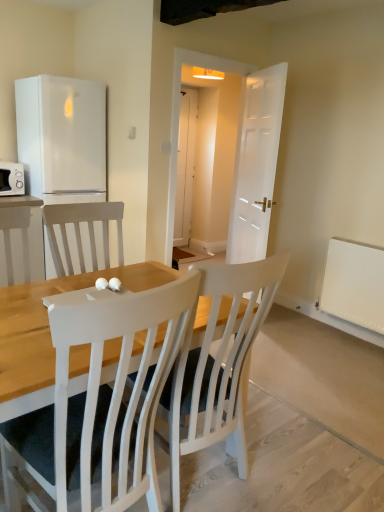
Question: Can you confirm if white matte microwave at left is positioned to the right of white wood chair at center?

Choices:
 (A) yes
 (B) no

Answer: (B)

Question: Can you confirm if white matte microwave at left is taller than white wood chair at center?

Choices:
 (A) yes
 (B) no

Answer: (A)

Question: Is white matte microwave at left in contact with white wood chair at center?

Choices:
 (A) yes
 (B) no

Answer: (B)

Question: Is white matte microwave at left to the left of white wood chair at center from the viewer's perspective?

Choices:
 (A) yes
 (B) no

Answer: (A)

Question: Is white matte microwave at left positioned beyond the bounds of white wood chair at center?

Choices:
 (A) yes
 (B) no

Answer: (A)

Question: From a real-world perspective, is white matte radiator at lower right physically located above or below white matte refrigerator at left?

Choices:
 (A) below
 (B) above

Answer: (A)

Question: Is white matte radiator at lower right taller or shorter than white matte refrigerator at left?

Choices:
 (A) tall
 (B) short

Answer: (B)

Question: Relative to white matte refrigerator at left, is white matte radiator at lower right in front or behind?

Choices:
 (A) behind
 (B) front

Answer: (B)

Question: Do you think white matte radiator at lower right is within white matte refrigerator at left, or outside of it?

Choices:
 (A) outside
 (B) inside

Answer: (A)

Question: Is white wood chair at center in front of or behind white matte refrigerator at left in the image?

Choices:
 (A) behind
 (B) front

Answer: (B)

Question: From a real-world perspective, is white wood chair at center physically located above or below white matte refrigerator at left?

Choices:
 (A) below
 (B) above

Answer: (A)

Question: Looking at their shapes, would you say white wood chair at center is wider or thinner than white matte refrigerator at left?

Choices:
 (A) thin
 (B) wide

Answer: (B)

Question: Considering the relative positions of white wood chair at center and white matte refrigerator at left in the image provided, is white wood chair at center to the left or to the right of white matte refrigerator at left?

Choices:
 (A) left
 (B) right

Answer: (B)

Question: Relative to white wood chair at center, is white matte radiator at lower right in front or behind?

Choices:
 (A) front
 (B) behind

Answer: (B)

Question: Is white matte radiator at lower right spatially inside white wood chair at center, or outside of it?

Choices:
 (A) outside
 (B) inside

Answer: (A)